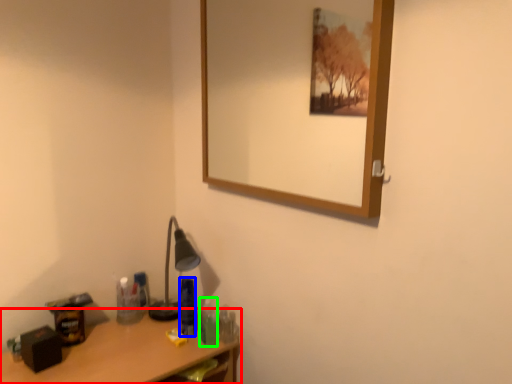
Question: Estimate the real-world distances between objects in this image. Which object is farther from desk (highlighted by a red box), toiletry (highlighted by a blue box) or toiletry (highlighted by a green box)?

Choices:
 (A) toiletry
 (B) toiletry

Answer: (B)